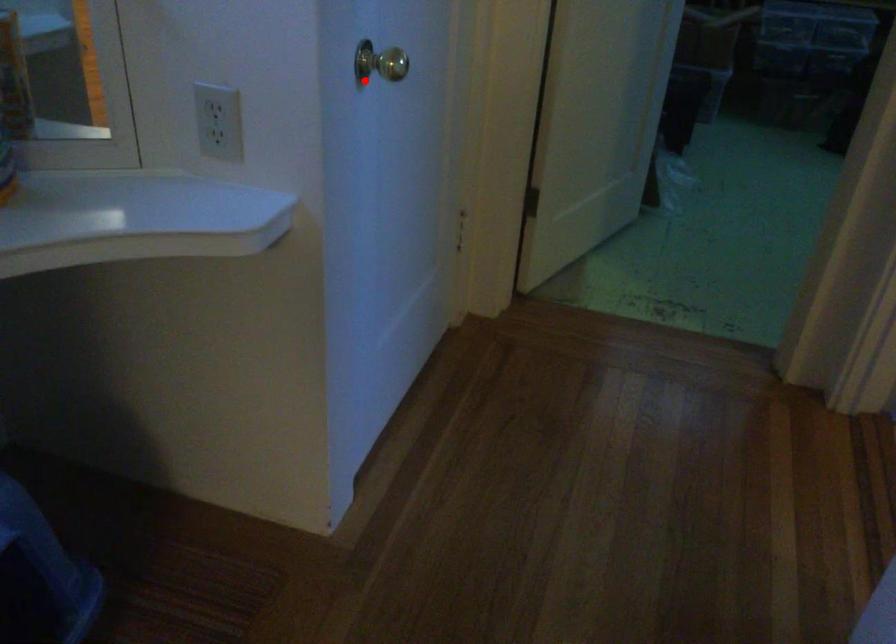
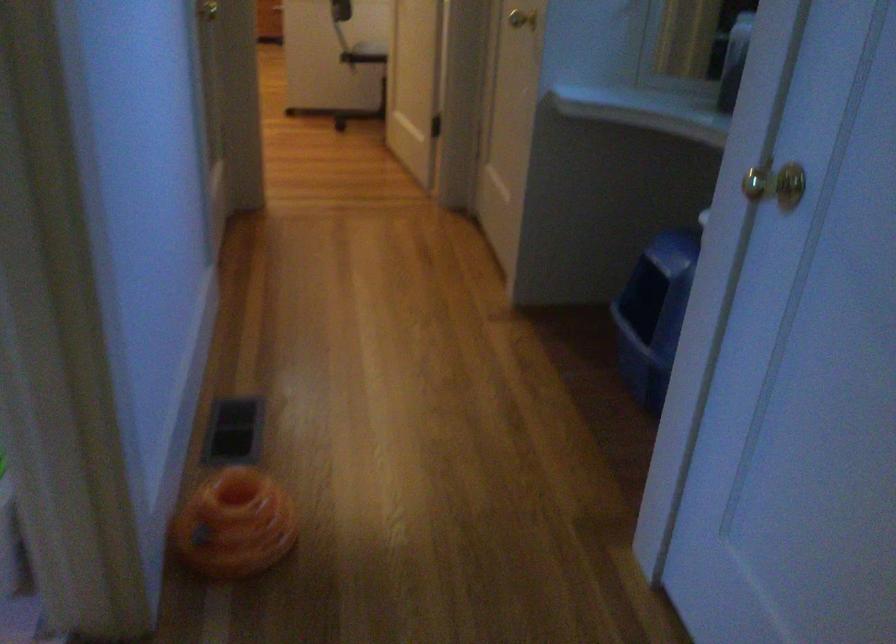
Locate, in the second image, the point that corresponds to the highlighted location in the first image.

(776, 184)